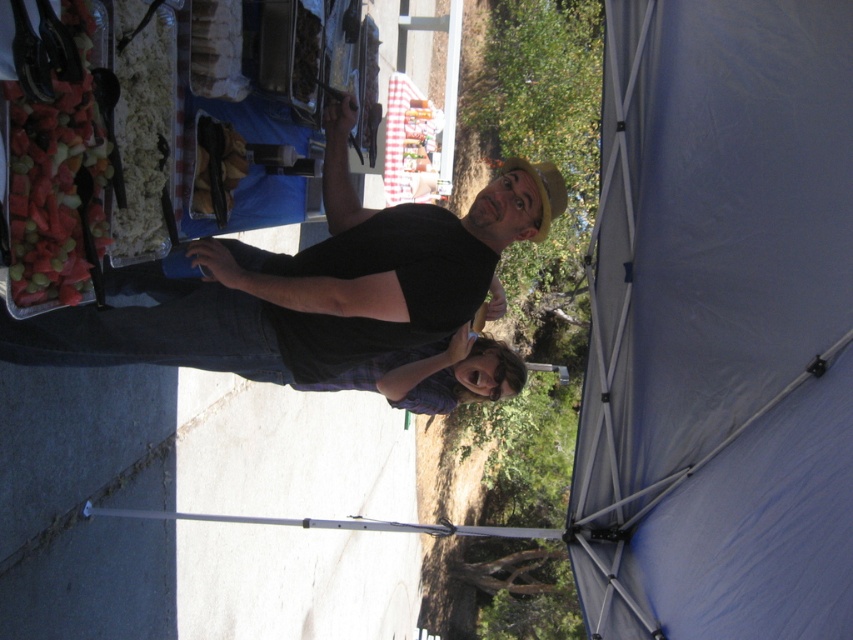
Question: Which object appears farthest from the camera in this image?

Choices:
 (A) black matte shirt at center
 (B) blue fabric tent at upper right

Answer: (A)

Question: In this image, where is blue fabric tent at upper right located relative to black matte shirt at center?

Choices:
 (A) left
 (B) right

Answer: (B)

Question: Can you confirm if blue fabric tent at upper right is smaller than black matte shirt at center?

Choices:
 (A) no
 (B) yes

Answer: (B)

Question: Is blue fabric tent at upper right positioned in front of black matte shirt at center?

Choices:
 (A) no
 (B) yes

Answer: (B)

Question: Which of the following is the closest to the observer?

Choices:
 (A) black matte shirt at center
 (B) blue fabric tent at upper right

Answer: (B)